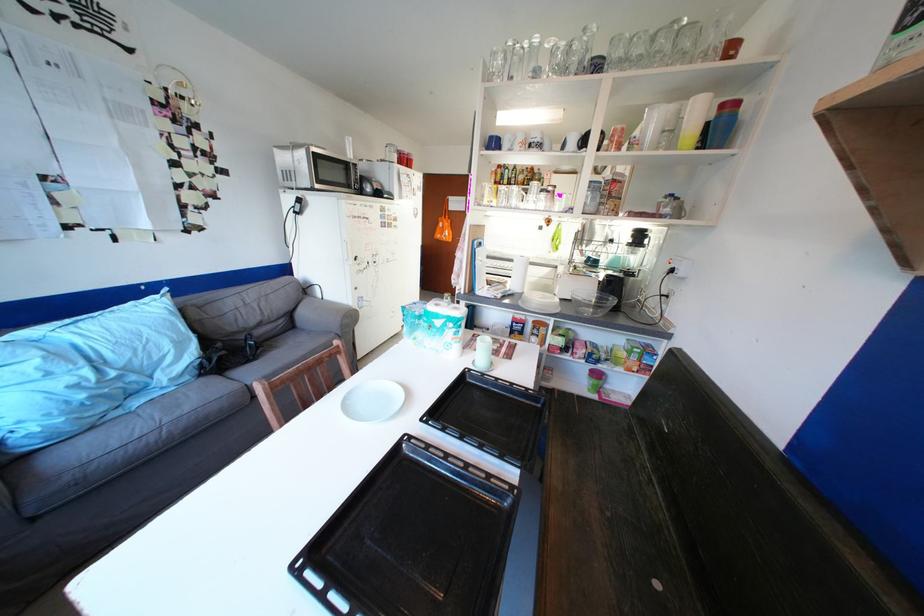
Locate an element on the screen. The image size is (924, 616). white mug is located at coordinates (482, 353).